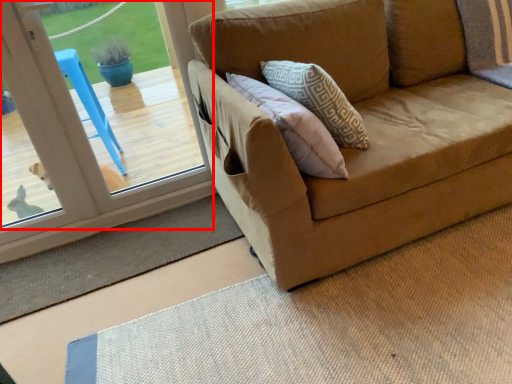
Question: In this image, where is window (annotated by the red box) located relative to doormat?

Choices:
 (A) right
 (B) left

Answer: (A)